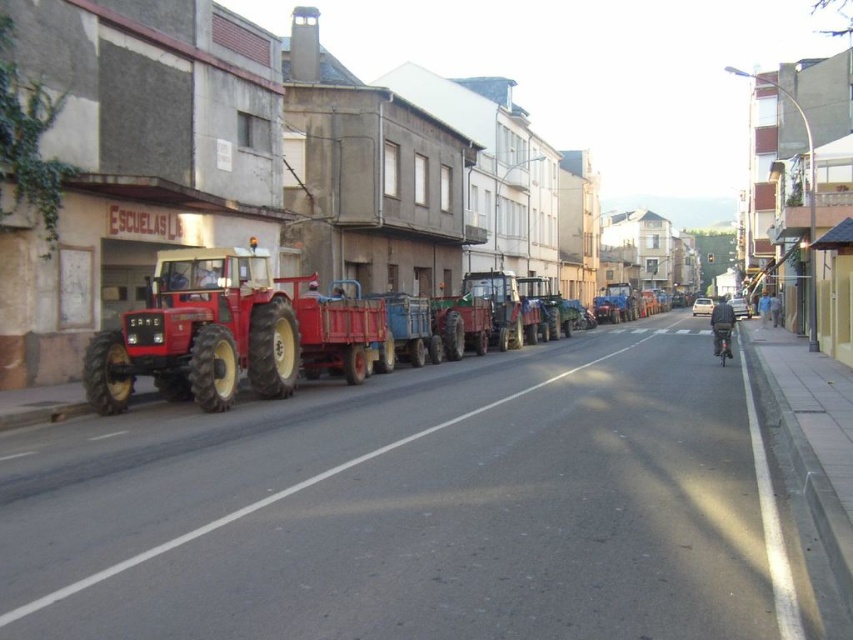
Question: Which of the following is the farthest from the observer?

Choices:
 (A) (722, 355)
 (B) (207, 256)

Answer: (A)

Question: Does matte red tractor at left appear under metallic red tractor at center?

Choices:
 (A) yes
 (B) no

Answer: (B)

Question: Can you confirm if matte red tractor at left is smaller than metallic red tractor at center?

Choices:
 (A) no
 (B) yes

Answer: (B)

Question: Can you confirm if matte red tractor at left is thinner than metallic red tractor at center?

Choices:
 (A) yes
 (B) no

Answer: (A)

Question: Among these objects, which one is farthest from the camera?

Choices:
 (A) shiny black motorcycle at center-right
 (B) metallic red tractor at center
 (C) matte red tractor at left

Answer: (A)

Question: Which of the following is the farthest from the observer?

Choices:
 (A) metallic red tractor at center
 (B) matte red tractor at left

Answer: (B)